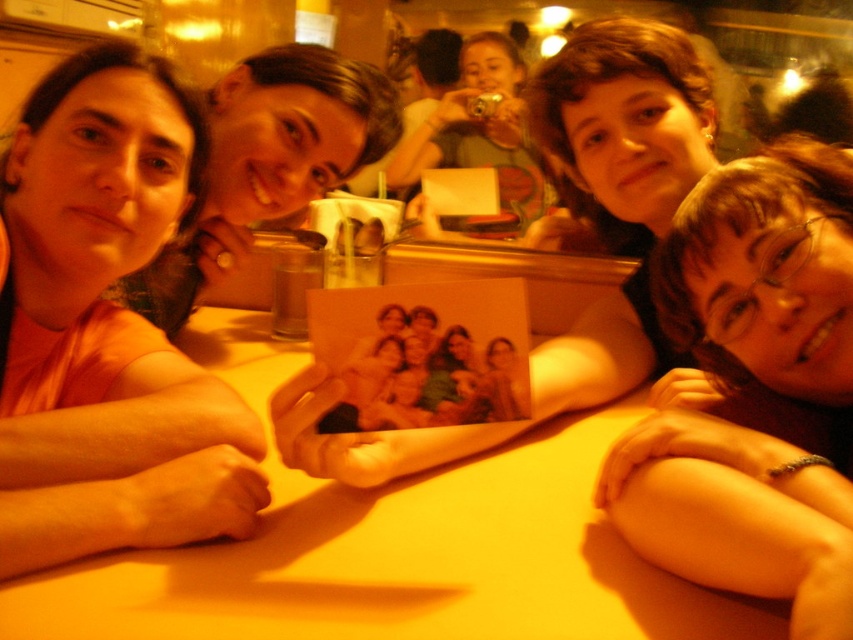
In the scene shown: Can you confirm if matte orange shirt at left is taller than smooth skin at lower right?

Indeed, matte orange shirt at left has a greater height compared to smooth skin at lower right.

Is point (111, 422) in front of point (726, 365)?

That is True.

This screenshot has height=640, width=853. What are the coordinates of `matte orange shirt at left` in the screenshot? It's located at (107, 326).

Who is positioned more to the right, yellow matte table at center or matte orange shirt at left?

Result: Positioned to the right is yellow matte table at center.

Between yellow matte table at center and matte orange shirt at left, which one appears on the left side from the viewer's perspective?

matte orange shirt at left

Does point (57, 625) lie behind point (115, 195)?

That is False.

The image size is (853, 640). I want to click on yellow matte table at center, so click(392, 547).

Is yellow matte table at center smaller than matte black photo at center?

A: Indeed, yellow matte table at center has a smaller size compared to matte black photo at center.

Who is positioned more to the right, yellow matte table at center or matte black photo at center?

From the viewer's perspective, matte black photo at center appears more on the right side.

Which is in front, point (412, 544) or point (651, 172)?

Point (412, 544) is more forward.

This screenshot has height=640, width=853. Identify the location of yellow matte table at center. (392, 547).